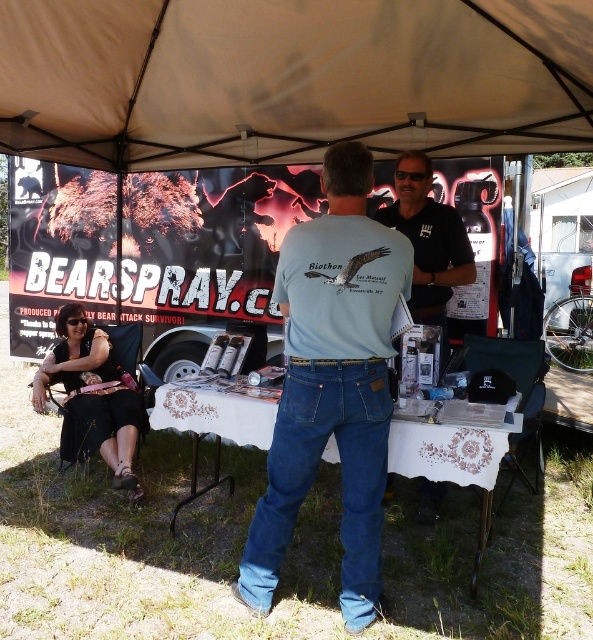
Is light blue cotton t-shirt at center to the left of black matte shirt at center from the viewer's perspective?

Yes, light blue cotton t-shirt at center is to the left of black matte shirt at center.

Is light blue cotton t-shirt at center shorter than black matte shirt at center?

No.

Is point (301, 240) less distant than point (419, 317)?

Yes.

This screenshot has width=593, height=640. I want to click on light blue cotton t-shirt at center, so click(333, 384).

Which is above, beige fabric canopy at upper center or white lace tablecloth at center?

Positioned higher is beige fabric canopy at upper center.

Between beige fabric canopy at upper center and white lace tablecloth at center, which one appears on the left side from the viewer's perspective?

beige fabric canopy at upper center

Between point (294, 64) and point (151, 420), which one is positioned behind?

Point (294, 64)

The image size is (593, 640). In order to click on beige fabric canopy at upper center in this screenshot , I will do `click(291, 77)`.

Does point (199, 12) come behind point (436, 216)?

Yes, point (199, 12) is farther from viewer.

Does beige fabric canopy at upper center have a larger size compared to black matte shirt at center?

Yes, beige fabric canopy at upper center is bigger than black matte shirt at center.

Is point (65, 45) farther from camera compared to point (425, 316)?

Yes, point (65, 45) is farther from viewer.

Identify the location of beige fabric canopy at upper center. The height and width of the screenshot is (640, 593). (291, 77).